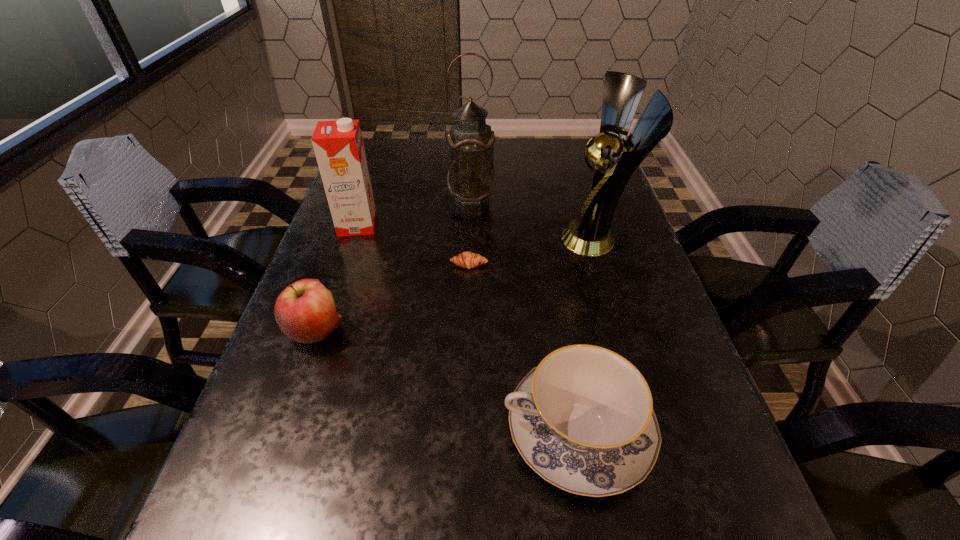
At what (x,y) coordinates should I click in order to perform the action: click on vacant space situated 0.070m on the right of the third tallest object. Please return your answer as a coordinate pair (x, y). Looking at the image, I should click on (405, 225).

At what (x,y) coordinates should I click in order to perform the action: click on vacant space located on the back of the apple. Please return your answer as a coordinate pair (x, y). Looking at the image, I should click on (359, 208).

The image size is (960, 540). In order to click on vacant space located with the handle on the side of the chinaware in this screenshot , I will do `click(296, 430)`.

The height and width of the screenshot is (540, 960). In order to click on vacant space situated 0.050m with the handle on the side of the chinaware in this screenshot , I will do `click(471, 430)`.

Image resolution: width=960 pixels, height=540 pixels. I want to click on free space located 0.180m with the handle on the side of the chinaware, so click(x=390, y=430).

The width and height of the screenshot is (960, 540). I want to click on vacant region located on the front-facing side of the pastry, so click(x=466, y=399).

Identify the location of carton at the left edge. (338, 145).

At what (x,y) coordinates should I click in order to perform the action: click on apple that is at the left edge. Please return your answer as a coordinate pair (x, y). Looking at the image, I should click on (305, 311).

Locate an element on the screen. The image size is (960, 540). award at the right edge is located at coordinates (616, 160).

This screenshot has height=540, width=960. Identify the location of chinaware positioned at the right edge. (583, 419).